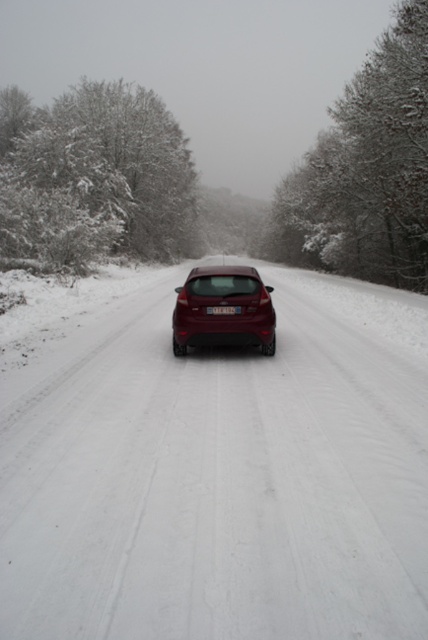
You are standing at the point closer to you in the snowy landscape scene. There are two points marked on the image, point A at coordinates point A is point (404, 266) and point B at coordinates point B is point (237, 308). Which point are you standing at?

You are standing at point A at coordinates point A is point (404, 266) because it is closer to the viewer than point B at coordinates point B is point (237, 308).